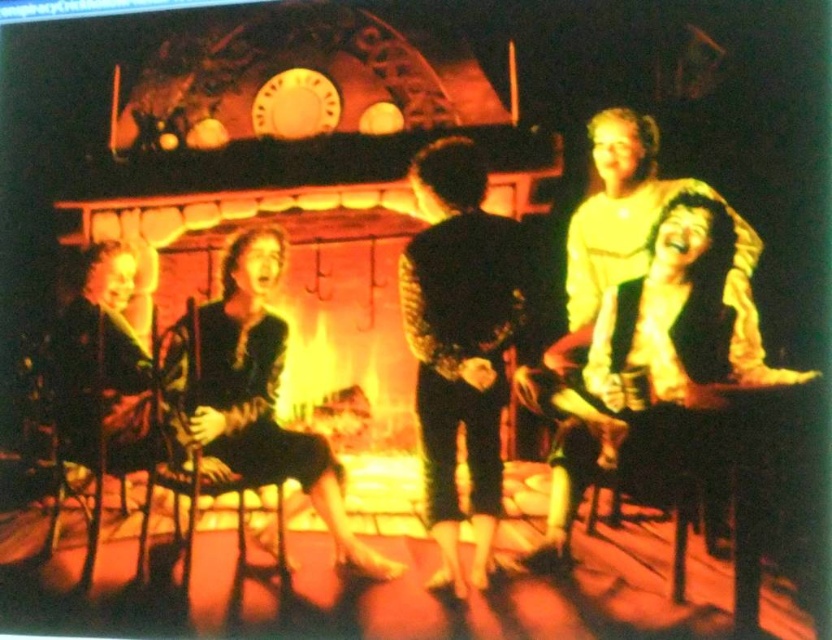
You are organizing a charity event and need to arrange the black textured jacket at center and the matte black dress at center on a display rack. According to the scene, which item should be placed higher on the rack?

The black textured jacket at center should be placed higher on the rack since it is positioned above the matte black dress at center in the original scene.

Where is the black textured jacket at center located in the scene?

The black textured jacket at center is located at point (459,342) in the scene.